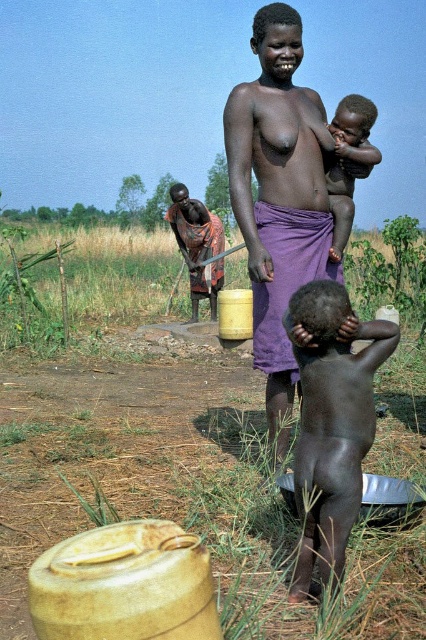
Question: Which point appears closest to the camera in this image?

Choices:
 (A) (345, 230)
 (B) (187, 211)
 (C) (307, 323)

Answer: (C)

Question: Based on their relative distances, which object is nearer to the dark skin baby at upper center?

Choices:
 (A) matte purple cloth at center
 (B) brown woven cloth at center

Answer: (A)

Question: Is dark skin baby at center smaller than brown woven cloth at center?

Choices:
 (A) no
 (B) yes

Answer: (B)

Question: Which point appears closest to the camera in this image?

Choices:
 (A) (367, 140)
 (B) (299, 568)
 (C) (167, 209)

Answer: (B)

Question: Does matte purple cloth at center have a lesser width compared to dark skin baby at upper center?

Choices:
 (A) yes
 (B) no

Answer: (B)

Question: Is matte purple cloth at center positioned before dark skin baby at upper center?

Choices:
 (A) yes
 (B) no

Answer: (A)